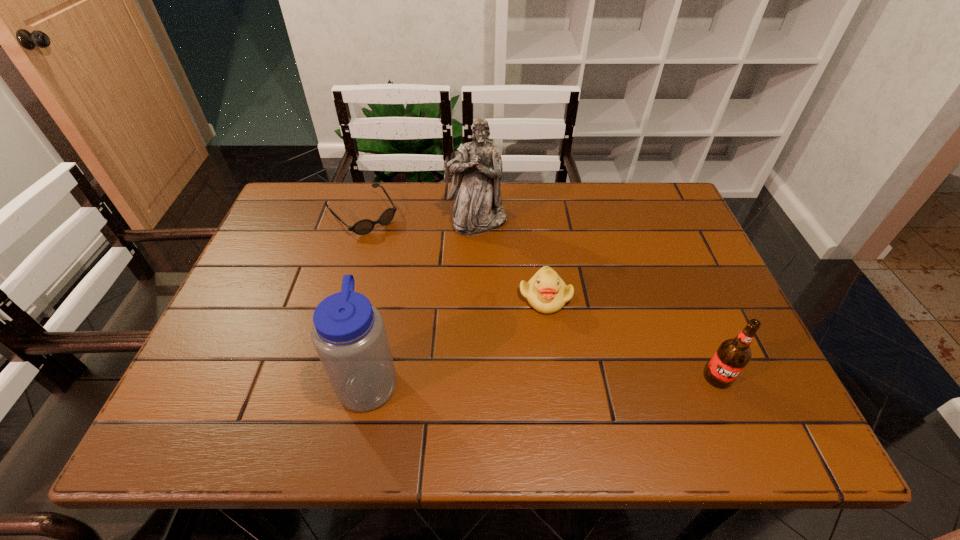
Image resolution: width=960 pixels, height=540 pixels. In order to click on free spot between the third object from left to right and the sunglasses in this screenshot , I will do `click(420, 218)`.

Where is `the third closest object to the water bottle`? the third closest object to the water bottle is located at coordinates click(x=477, y=170).

Where is `the closest object relative to the rightmost object`? the closest object relative to the rightmost object is located at coordinates (546, 292).

Locate an element on the screen. This screenshot has height=540, width=960. vacant point that satisfies the following two spatial constraints: 1. on the front side of the third tallest object; 2. on the right side of the fourth tallest object is located at coordinates (557, 377).

Image resolution: width=960 pixels, height=540 pixels. What are the coordinates of `free space that satisfies the following two spatial constraints: 1. on the front side of the third shortest object; 2. on the right side of the sunglasses` in the screenshot? It's located at (315, 377).

You are a GUI agent. You are given a task and a screenshot of the screen. Output one action in this format:
    pyautogui.click(x=<x>, y=<y>)
    Task: Click on the free spot that satisfies the following two spatial constraints: 1. on the front side of the fourth shortest object; 2. with a carrying loop on the side of the shortest object
    Image resolution: width=960 pixels, height=540 pixels.
    Given the screenshot: What is the action you would take?
    pyautogui.click(x=314, y=380)

Where is `vacant point that satisfies the following two spatial constraints: 1. on the front side of the tallest object; 2. on the right side of the shortest object`? vacant point that satisfies the following two spatial constraints: 1. on the front side of the tallest object; 2. on the right side of the shortest object is located at coordinates (361, 221).